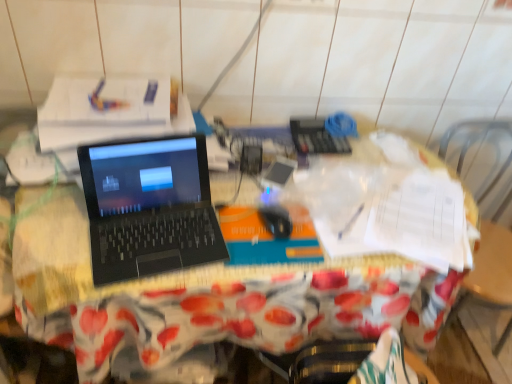
Question: Is black plastic laptop at center not near black matte laptop at center?

Choices:
 (A) no
 (B) yes

Answer: (A)

Question: Can you confirm if black plastic laptop at center is positioned to the left of black matte laptop at center?

Choices:
 (A) yes
 (B) no

Answer: (B)

Question: Considering the relative sizes of black plastic laptop at center and black matte laptop at center in the image provided, is black plastic laptop at center bigger than black matte laptop at center?

Choices:
 (A) yes
 (B) no

Answer: (A)

Question: Considering the relative sizes of black plastic laptop at center and black matte laptop at center in the image provided, is black plastic laptop at center thinner than black matte laptop at center?

Choices:
 (A) no
 (B) yes

Answer: (A)

Question: Is the depth of black plastic laptop at center less than that of black matte laptop at center?

Choices:
 (A) yes
 (B) no

Answer: (B)

Question: From their relative heights in the image, would you say black plastic laptop at center is taller or shorter than black matte laptop at center?

Choices:
 (A) tall
 (B) short

Answer: (A)

Question: Is black plastic laptop at center wider or thinner than black matte laptop at center?

Choices:
 (A) wide
 (B) thin

Answer: (A)

Question: Is black plastic laptop at center in front of or behind black matte laptop at center in the image?

Choices:
 (A) front
 (B) behind

Answer: (B)

Question: Is black plastic laptop at center inside or outside of black matte laptop at center?

Choices:
 (A) inside
 (B) outside

Answer: (B)

Question: From the image's perspective, is black plastic laptop at center located above or below black matte mouse at center?

Choices:
 (A) above
 (B) below

Answer: (B)

Question: In terms of height, does black plastic laptop at center look taller or shorter compared to black matte mouse at center?

Choices:
 (A) tall
 (B) short

Answer: (A)

Question: Based on their sizes in the image, would you say black plastic laptop at center is bigger or smaller than black matte mouse at center?

Choices:
 (A) big
 (B) small

Answer: (A)

Question: Based on their positions, is black plastic laptop at center located to the left or right of black matte mouse at center?

Choices:
 (A) right
 (B) left

Answer: (B)

Question: Is black matte laptop at center to the left or to the right of black matte mouse at center in the image?

Choices:
 (A) right
 (B) left

Answer: (B)

Question: From their relative heights in the image, would you say black matte laptop at center is taller or shorter than black matte mouse at center?

Choices:
 (A) tall
 (B) short

Answer: (A)